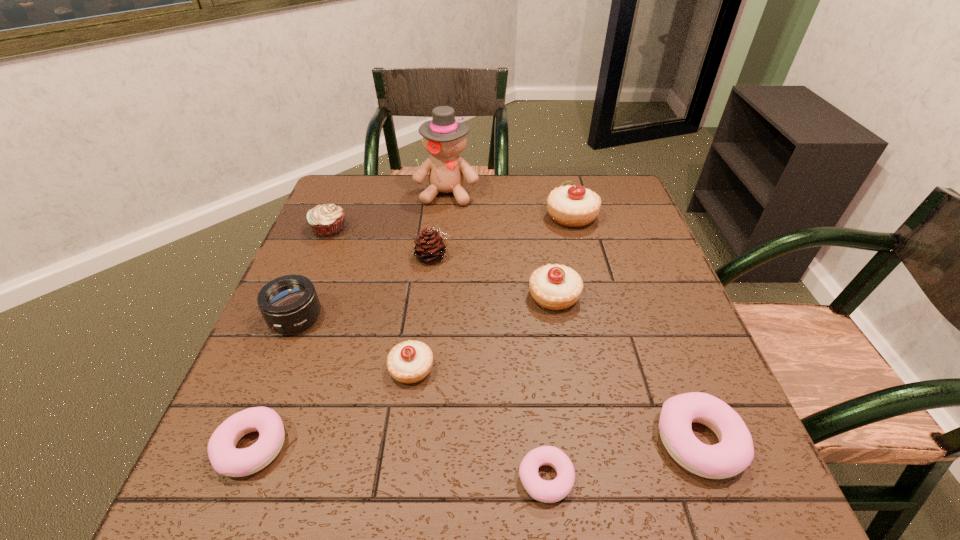
Image resolution: width=960 pixels, height=540 pixels. What are the coordinates of `the fourth nearest pastry` in the screenshot? It's located at (411, 361).

Where is `the rightmost pink pastry`? the rightmost pink pastry is located at coordinates (734, 453).

This screenshot has width=960, height=540. What are the coordinates of `the third shortest object` in the screenshot? It's located at (734, 453).

Locate an element on the screen. This screenshot has width=960, height=540. the fifth tallest pastry is located at coordinates (226, 459).

This screenshot has height=540, width=960. I want to click on the second shortest object, so click(x=226, y=459).

At what (x,y) coordinates should I click in order to perform the action: click on the shortest pastry. Please return your answer as a coordinate pair (x, y). Looking at the image, I should click on (541, 490).

At what (x,y) coordinates should I click in order to perform the action: click on the smallest pink pastry. Please return your answer as a coordinate pair (x, y). Looking at the image, I should click on click(x=541, y=490).

Where is `vacant space located 0.070m on the front-facing side of the tallest object`? The height and width of the screenshot is (540, 960). vacant space located 0.070m on the front-facing side of the tallest object is located at coordinates (444, 222).

This screenshot has width=960, height=540. I want to click on vacant space located 0.290m on the front of the farthest pastry, so click(596, 310).

Locate an element on the screen. Image resolution: width=960 pixels, height=540 pixels. vacant space located 0.370m with a leaf charm attached to the seventh nearest object is located at coordinates (599, 256).